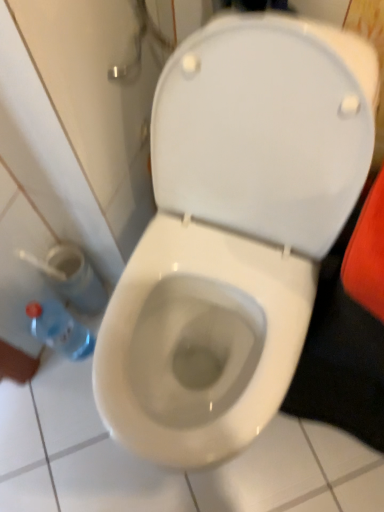
Question: In terms of size, does blue plastic bottle at lower left appear bigger or smaller than white glossy toilet at center?

Choices:
 (A) big
 (B) small

Answer: (B)

Question: Is blue plastic bottle at lower left taller or shorter than white glossy toilet at center?

Choices:
 (A) short
 (B) tall

Answer: (A)

Question: From a real-world perspective, is blue plastic bottle at lower left physically located above or below white glossy toilet at center?

Choices:
 (A) above
 (B) below

Answer: (B)

Question: Considering the relative positions of white glossy toilet at center and blue plastic bottle at lower left in the image provided, is white glossy toilet at center to the left or to the right of blue plastic bottle at lower left?

Choices:
 (A) right
 (B) left

Answer: (A)

Question: Is white glossy toilet at center wider or thinner than blue plastic bottle at lower left?

Choices:
 (A) wide
 (B) thin

Answer: (A)

Question: Is point (119, 411) positioned closer to the camera than point (33, 328)?

Choices:
 (A) farther
 (B) closer

Answer: (B)

Question: Is white glossy toilet at center in front of or behind blue plastic bottle at lower left in the image?

Choices:
 (A) behind
 (B) front

Answer: (B)